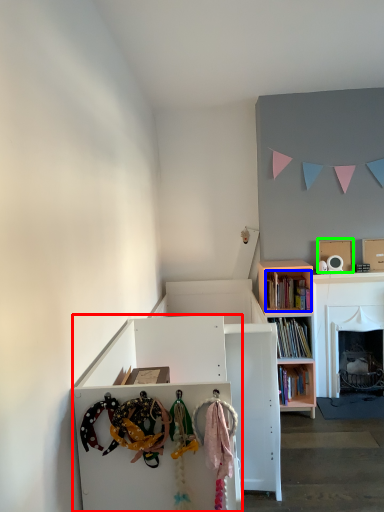
Question: Which object is positioned farthest from cabinetry (highlighted by a red box)? Select from book (highlighted by a blue box) and cardboard box (highlighted by a green box).

Choices:
 (A) book
 (B) cardboard box

Answer: (B)